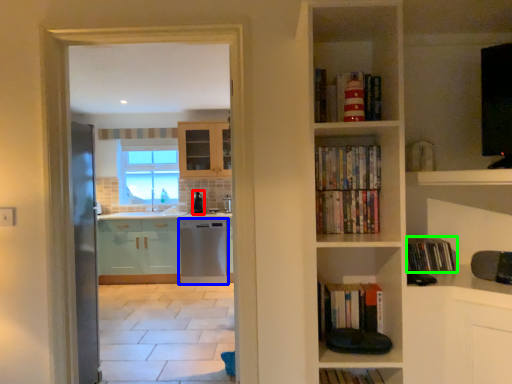
Question: Considering the real-world distances, which object is closest to appliance (highlighted by a red box)? dish washer (highlighted by a blue box) or book (highlighted by a green box).

Choices:
 (A) dish washer
 (B) book

Answer: (A)